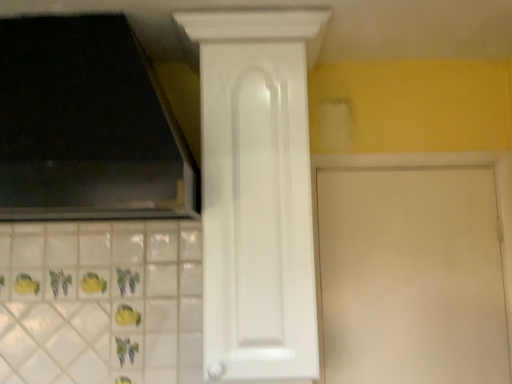
Question: Which direction should I rotate to look at white glossy cabinet door at center, the 1th door in the left-to-right sequence, — up or down?

Choices:
 (A) down
 (B) up

Answer: (A)

Question: Can white matte door at center, the first door positioned from the right, be found inside white glossy cabinet door at center, marked as the second door in a right-to-left arrangement?

Choices:
 (A) yes
 (B) no

Answer: (B)

Question: From a real-world perspective, does white glossy cabinet door at center, the 1th door in the left-to-right sequence, stand above white matte door at center, positioned as the 2th door in left-to-right order?

Choices:
 (A) no
 (B) yes

Answer: (B)

Question: Is white glossy cabinet door at center, the 1th door in the left-to-right sequence, behind white matte door at center, positioned as the 2th door in left-to-right order?

Choices:
 (A) no
 (B) yes

Answer: (A)

Question: From a real-world perspective, is white glossy cabinet door at center, the 1th door in the left-to-right sequence, positioned under white matte door at center, the first door positioned from the right, based on gravity?

Choices:
 (A) yes
 (B) no

Answer: (B)

Question: Is white glossy cabinet door at center, marked as the second door in a right-to-left arrangement, oriented towards white matte door at center, positioned as the 2th door in left-to-right order?

Choices:
 (A) no
 (B) yes

Answer: (A)

Question: Is white glossy cabinet door at center, marked as the second door in a right-to-left arrangement, directly adjacent to white matte door at center, the first door positioned from the right?

Choices:
 (A) no
 (B) yes

Answer: (A)

Question: Would you say white glossy cabinet door at center, the 1th door in the left-to-right sequence, is part of white matte door at center, positioned as the 2th door in left-to-right order,'s contents?

Choices:
 (A) yes
 (B) no

Answer: (B)

Question: Considering the relative sizes of white matte door at center, the first door positioned from the right, and white glossy cabinet door at center, marked as the second door in a right-to-left arrangement, in the image provided, is white matte door at center, the first door positioned from the right, bigger than white glossy cabinet door at center, marked as the second door in a right-to-left arrangement,?

Choices:
 (A) yes
 (B) no

Answer: (B)

Question: Is white matte door at center, the first door positioned from the right, thinner than white glossy cabinet door at center, marked as the second door in a right-to-left arrangement?

Choices:
 (A) no
 (B) yes

Answer: (B)

Question: Is there a large distance between white matte door at center, the first door positioned from the right, and white glossy cabinet door at center, marked as the second door in a right-to-left arrangement?

Choices:
 (A) no
 (B) yes

Answer: (A)

Question: Considering the relative sizes of white matte door at center, the first door positioned from the right, and white glossy cabinet door at center, marked as the second door in a right-to-left arrangement, in the image provided, is white matte door at center, the first door positioned from the right, taller than white glossy cabinet door at center, marked as the second door in a right-to-left arrangement,?

Choices:
 (A) yes
 (B) no

Answer: (B)

Question: Can you confirm if white matte door at center, positioned as the 2th door in left-to-right order, is shorter than white glossy cabinet door at center, marked as the second door in a right-to-left arrangement?

Choices:
 (A) yes
 (B) no

Answer: (A)

Question: Is white matte door at center, the first door positioned from the right, wider or thinner than white glossy cabinet door at center, the 1th door in the left-to-right sequence?

Choices:
 (A) thin
 (B) wide

Answer: (A)